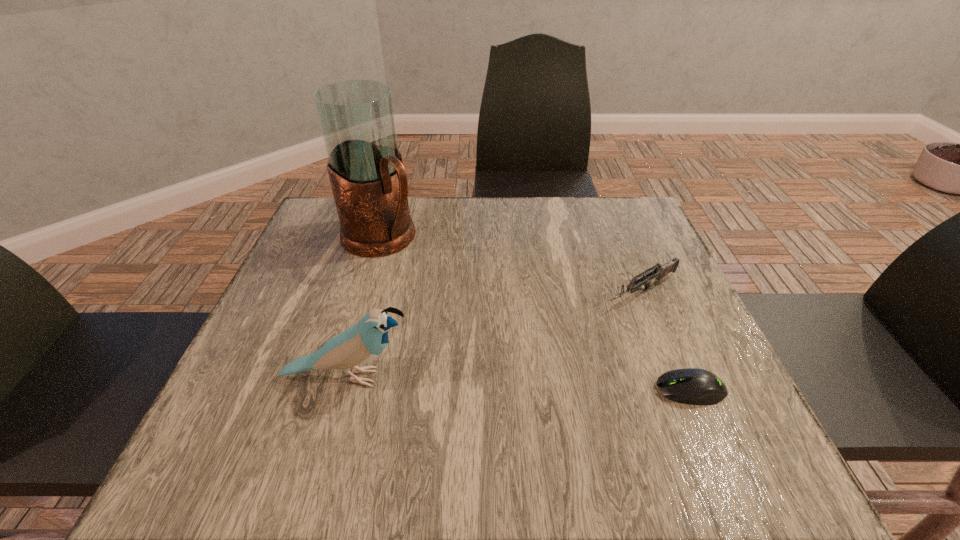
Locate an element on the screen. The width and height of the screenshot is (960, 540). free location that satisfies the following two spatial constraints: 1. on the front side of the tallest object; 2. on the wheel side of the computer mouse is located at coordinates (337, 390).